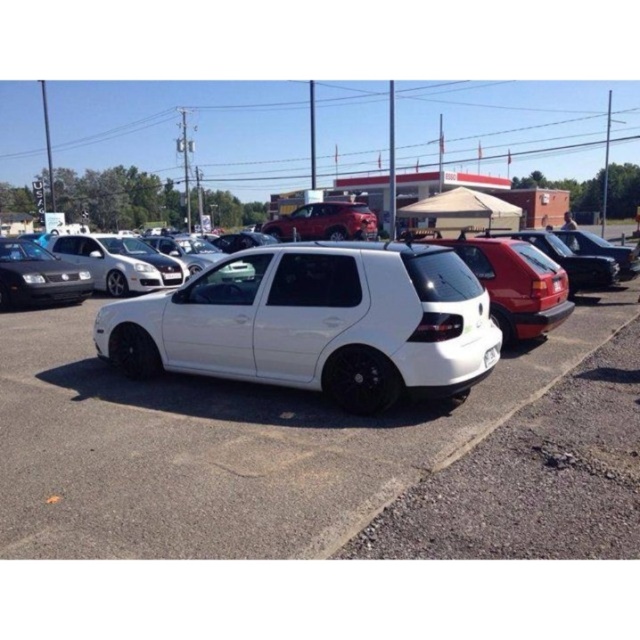
Can you confirm if white matte hatchback at center is positioned to the right of shiny red suv at center?

No, white matte hatchback at center is not to the right of shiny red suv at center.

Does point (196, 292) come farther from viewer compared to point (376, 227)?

No, it is not.

Find the location of a particular element. white matte hatchback at center is located at coordinates (316, 323).

Can you confirm if white matte hatchback at center is wider than glossy red hatchback at center?

Yes.

Between white matte hatchback at center and glossy red hatchback at center, which one appears on the right side from the viewer's perspective?

glossy red hatchback at center

What are the coordinates of `white matte hatchback at center` in the screenshot? It's located at (316, 323).

Does white glossy hatchback at center appear over satin black hatchback at right?

No.

Can you confirm if white glossy hatchback at center is shorter than satin black hatchback at right?

Correct, white glossy hatchback at center is not as tall as satin black hatchback at right.

At what (x,y) coordinates should I click in order to perform the action: click on white glossy hatchback at center. Please return your answer as a coordinate pair (x, y). Looking at the image, I should click on (225, 448).